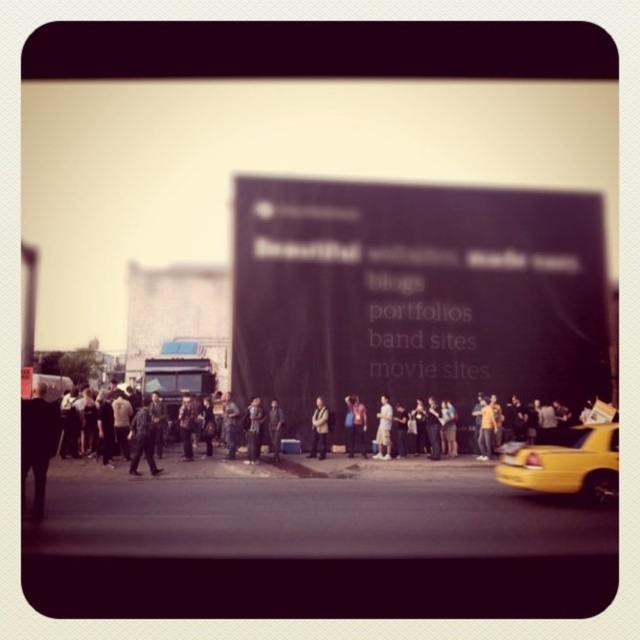
Between dark gray sweater at center and white cotton dress at center, which one has more height?

With more height is white cotton dress at center.

Is dark gray sweater at center wider than white cotton dress at center?

No, dark gray sweater at center is not wider than white cotton dress at center.

What do you see at coordinates (253, 429) in the screenshot?
I see `dark gray sweater at center` at bounding box center [253, 429].

Find the location of `dark gray sweater at center`. dark gray sweater at center is located at coordinates (253, 429).

Based on the photo, can you confirm if yellow matte taxi at lower right is bigger than camouflage fabric person at center?

Yes, yellow matte taxi at lower right is bigger than camouflage fabric person at center.

What are the coordinates of `yellow matte taxi at lower right` in the screenshot? It's located at (564, 461).

Where is `yellow matte taxi at lower right`? yellow matte taxi at lower right is located at coordinates (564, 461).

Who is positioned more to the right, dark gray suit at left or dark gray sweater at center?

From the viewer's perspective, dark gray sweater at center appears more on the right side.

Does dark gray suit at left have a greater height compared to dark gray sweater at center?

Yes.

This screenshot has width=640, height=640. What do you see at coordinates (36, 445) in the screenshot?
I see `dark gray suit at left` at bounding box center [36, 445].

Identify the location of dark gray suit at left. This screenshot has height=640, width=640. (36, 445).